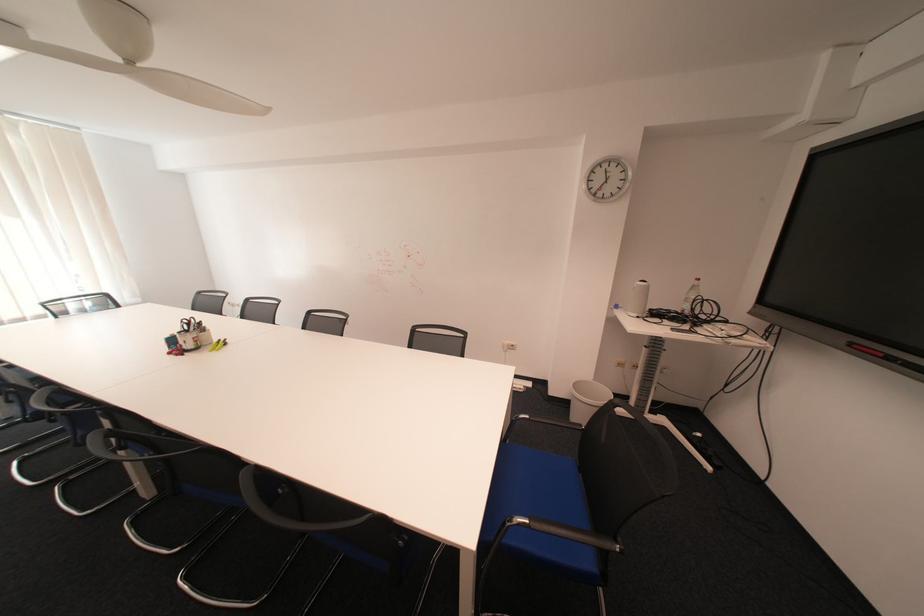
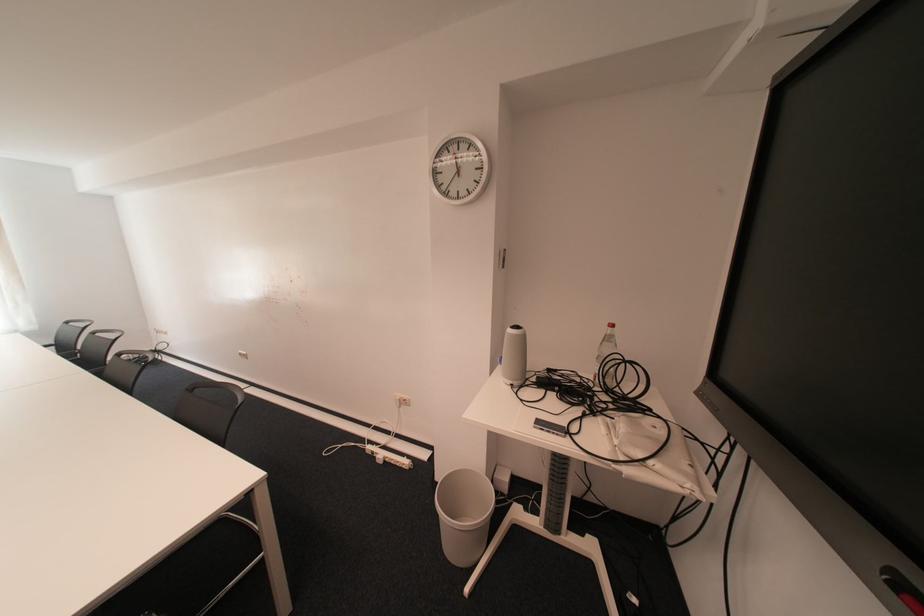
The images are taken continuously from a first-person perspective. In which direction are you moving?

The cameraman walked toward right, forward.